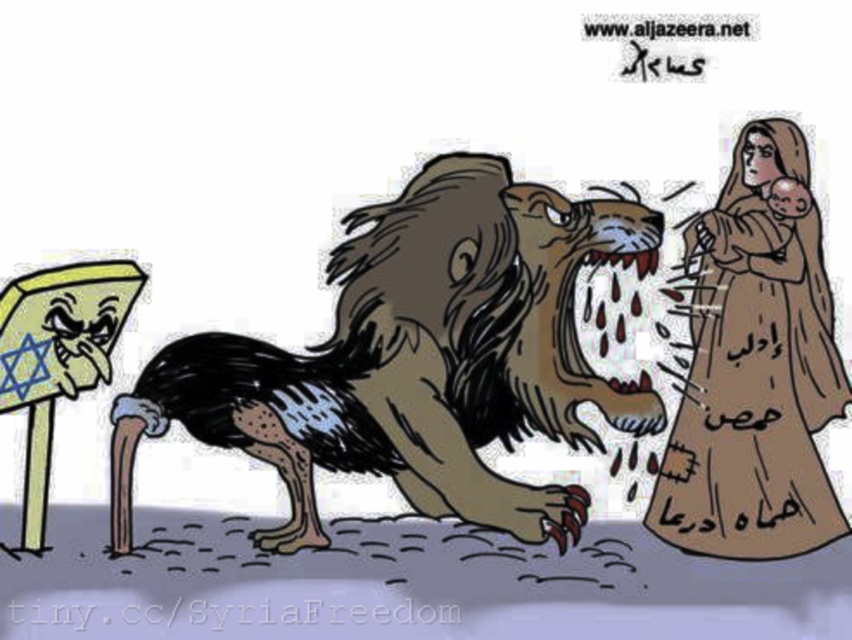
Question: Which object appears closest to the camera in this image?

Choices:
 (A) brown furry lion at center
 (B) brown fabric person at right

Answer: (B)

Question: Estimate the real-world distances between objects in this image. Which object is closer to the yellow paper sign at left?

Choices:
 (A) brown fabric person at right
 (B) brown furry lion at center

Answer: (B)

Question: Among these points, which one is farthest from the camera?

Choices:
 (A) (456, 500)
 (B) (746, 243)

Answer: (A)

Question: Can you confirm if brown furry lion at center is wider than brown fabric person at right?

Choices:
 (A) no
 (B) yes

Answer: (B)

Question: Considering the relative positions of brown furry lion at center and brown fabric person at right in the image provided, where is brown furry lion at center located with respect to brown fabric person at right?

Choices:
 (A) above
 (B) below

Answer: (B)

Question: Can you confirm if brown furry lion at center is positioned to the right of brown fabric person at right?

Choices:
 (A) yes
 (B) no

Answer: (B)